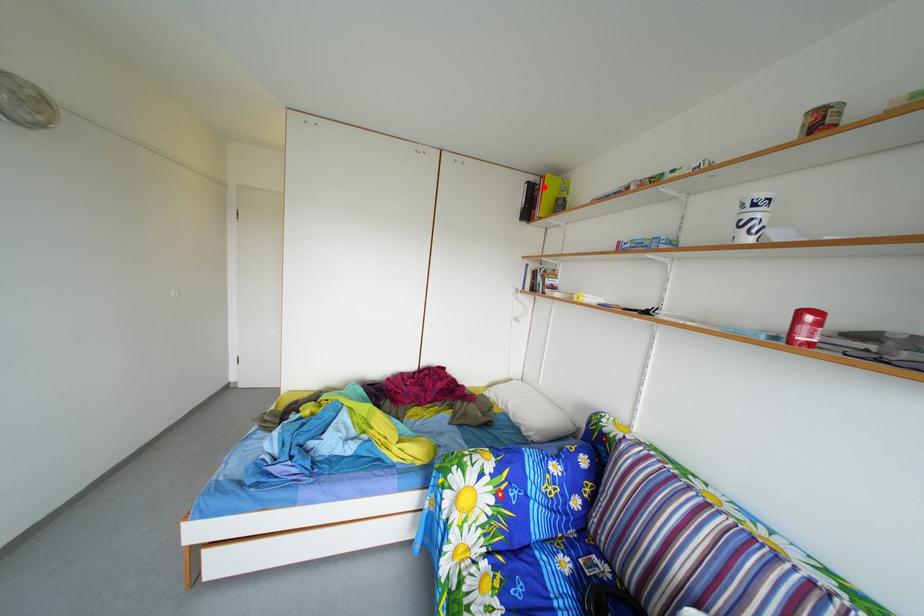
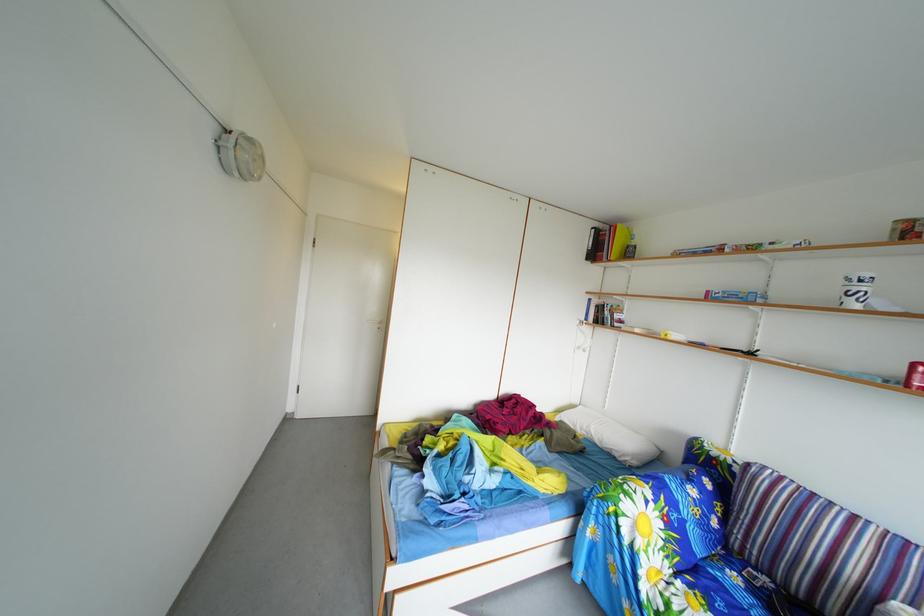
Where in the second image is the point corresponding to the highlighted location from the first image?

(608, 233)